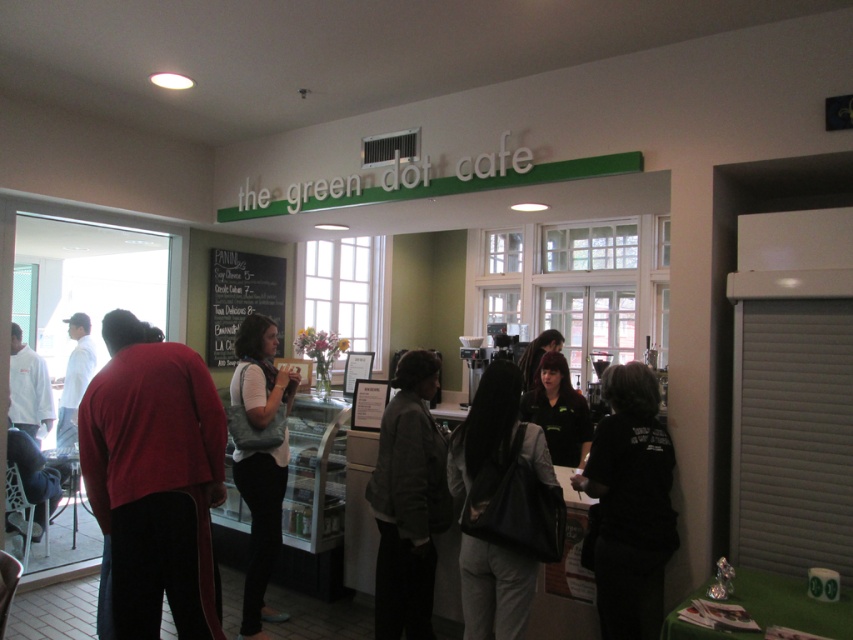
Question: In this image, where is gray fuzzy vest at center located relative to white matte chef coat at left?

Choices:
 (A) below
 (B) above

Answer: (A)

Question: Which point appears farthest from the camera in this image?

Choices:
 (A) (579, 397)
 (B) (469, 630)
 (C) (202, 620)

Answer: (A)

Question: Can you confirm if black matte shirt at center is thinner than gray fabric jacket at center?

Choices:
 (A) no
 (B) yes

Answer: (B)

Question: Which of these objects is positioned farthest from the gray fabric tote bag at center?

Choices:
 (A) white matte chef coat at left
 (B) gray fabric jacket at center

Answer: (A)

Question: Observing the image, what is the correct spatial positioning of dark red sweater at left in reference to white matte chef coat at left?

Choices:
 (A) left
 (B) right

Answer: (B)

Question: Which point is closer to the camera?

Choices:
 (A) dark red sweater at left
 (B) white cotton shirt at left
 (C) gray fabric jacket at center

Answer: (A)